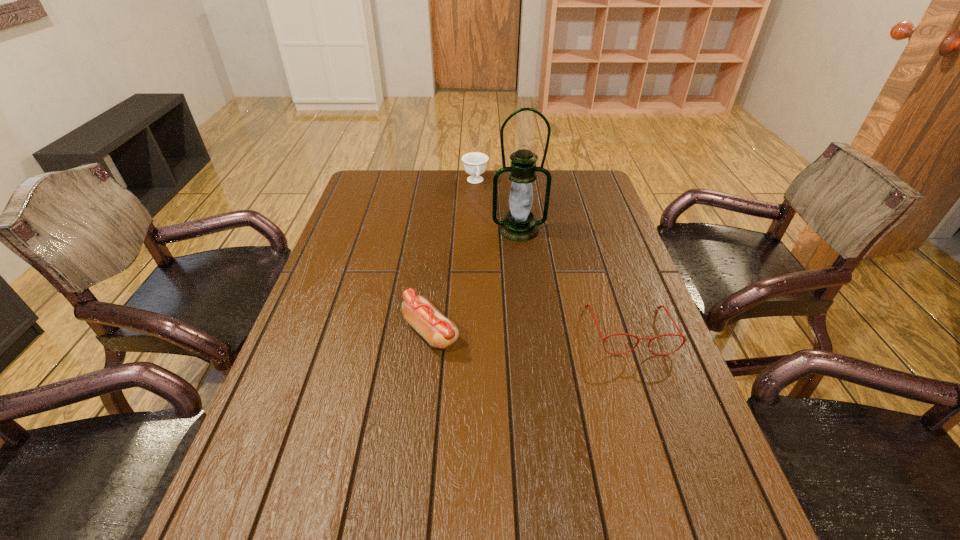
I want to click on object that is the second closest to the teacup, so click(440, 332).

Where is `the closest object to the sausage`? The width and height of the screenshot is (960, 540). the closest object to the sausage is located at coordinates (519, 224).

In order to click on free space that satisfies the following two spatial constraints: 1. on the back side of the third object from left to right; 2. on the right side of the sausage in this screenshot , I will do `click(443, 230)`.